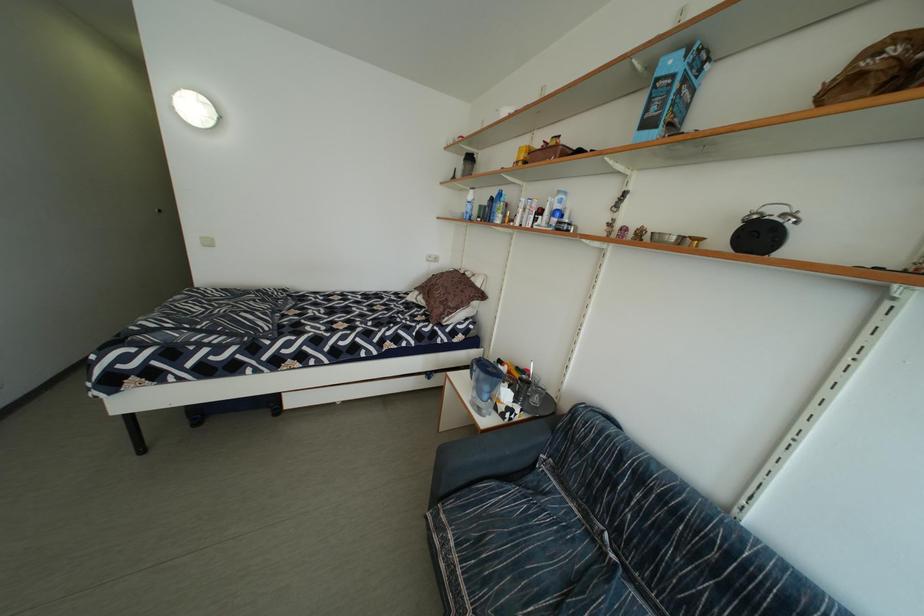
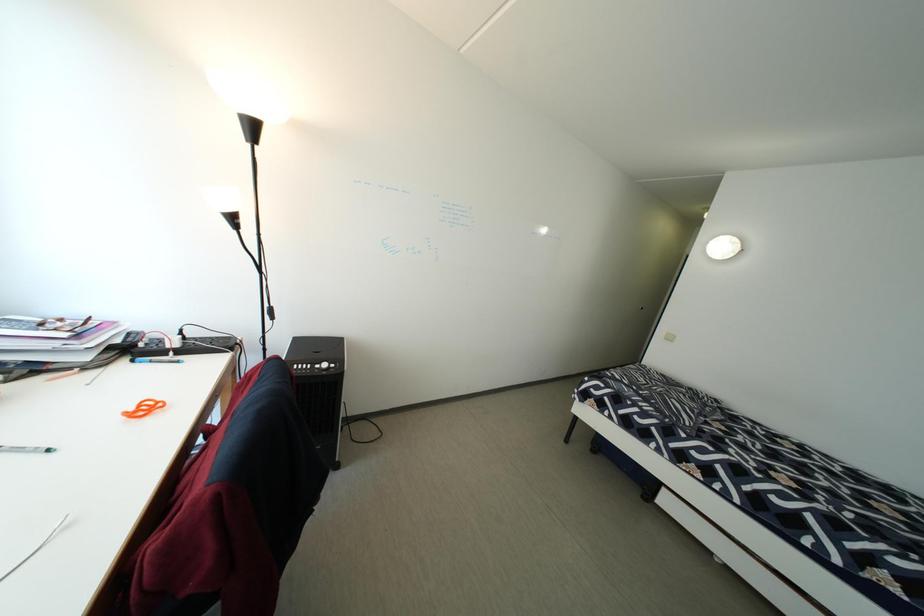
Question: The camera is either moving clockwise (left) or counter-clockwise (right) around the object. The first image is from the beginning of the video and the second image is from the end. Is the camera moving left or right when shooting the video?

Choices:
 (A) Left
 (B) Right

Answer: (B)